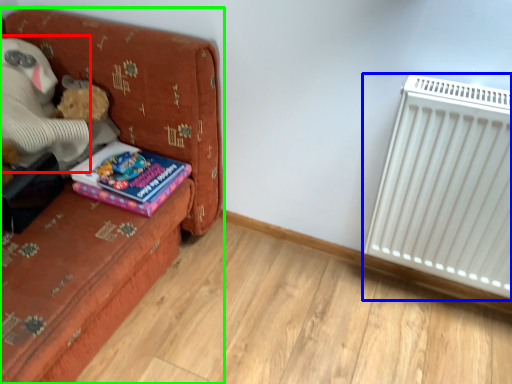
Question: Estimate the real-world distances between objects in this image. Which object is closer to teddy (highlighted by a red box), radiator (highlighted by a blue box) or furniture (highlighted by a green box)?

Choices:
 (A) radiator
 (B) furniture

Answer: (B)